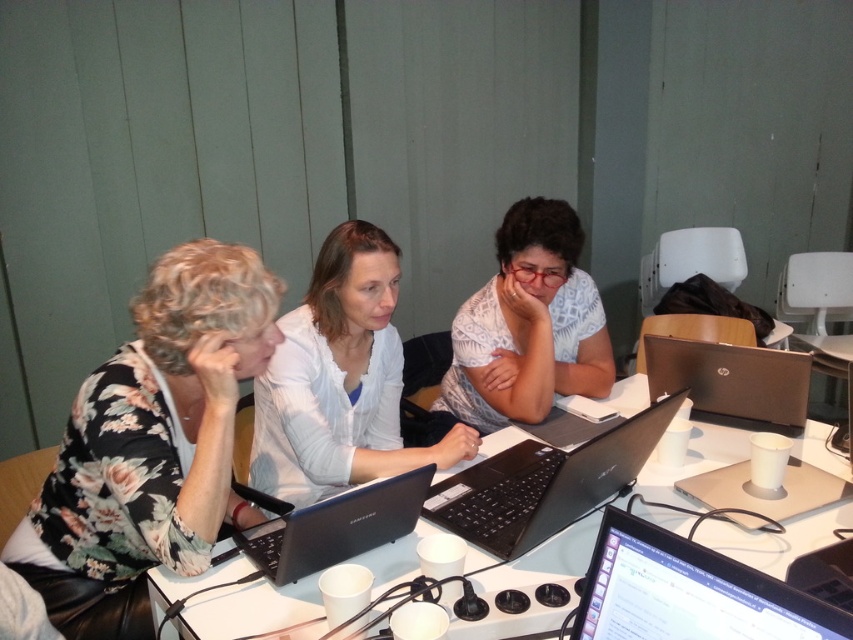
You are a photographer setting up for a group photo. You need to position the floral fabric blouse at left and the white plastic table at center in your frame. Based on their positions, which object should you place closer to the left edge of your camera viewfinder?

The floral fabric blouse at left should be placed closer to the left edge of the camera viewfinder since it is positioned on the left side of the white plastic table at center.

In the scene shown: You are a photographer trying to capture a candid shot of the white textured shirt at center and the black glossy laptop at center. Since you want to ensure both are in focus, you need to know their relative positions. Which object is located to the right of the other?

The white textured shirt at center is positioned on the right side of black glossy laptop at center, so the white textured shirt at center is to the right of the black glossy laptop at center.

You are a person who wants to reach for the black glossy laptop at center without moving the silver metallic laptop at right. Is this possible?

The black glossy laptop at center is behind the silver metallic laptop at right, so you cannot reach it without moving the silver metallic laptop at right.